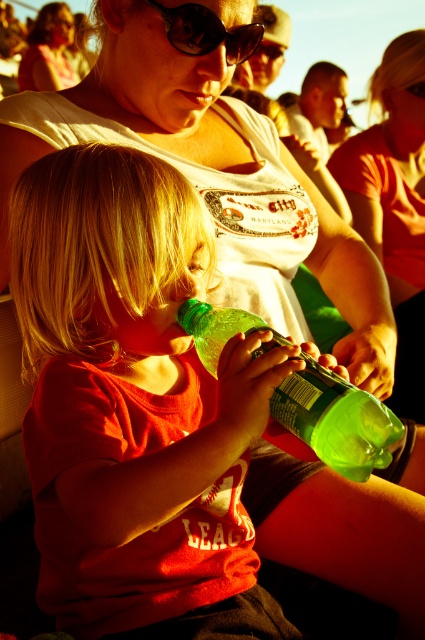
Question: Is black plastic sunglasses at upper center below matte black tank top at upper center?

Choices:
 (A) yes
 (B) no

Answer: (A)

Question: Which of the following is the farthest from the observer?

Choices:
 (A) [x=419, y=259]
 (B) [x=67, y=26]

Answer: (B)

Question: Can you confirm if matte white t-shirt at center is positioned to the left of matte black tank top at upper center?

Choices:
 (A) yes
 (B) no

Answer: (B)

Question: Estimate the real-world distances between objects in this image. Which object is farther from the matte white t-shirt at center?

Choices:
 (A) green translucent bottle at center
 (B) black plastic sunglasses at upper center

Answer: (A)

Question: Among these objects, which one is nearest to the camera?

Choices:
 (A) matte white t-shirt at center
 (B) green translucent bottle at center
 (C) matte black tank top at upper center
 (D) black plastic sunglasses at upper center

Answer: (B)

Question: Can you confirm if matte white t-shirt at center is positioned to the left of matte black tank top at upper center?

Choices:
 (A) yes
 (B) no

Answer: (B)